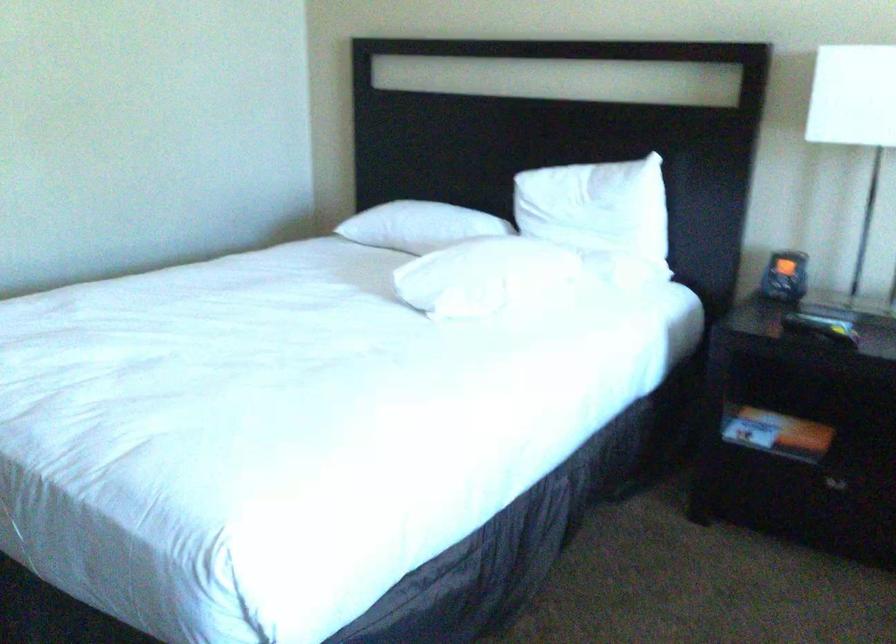
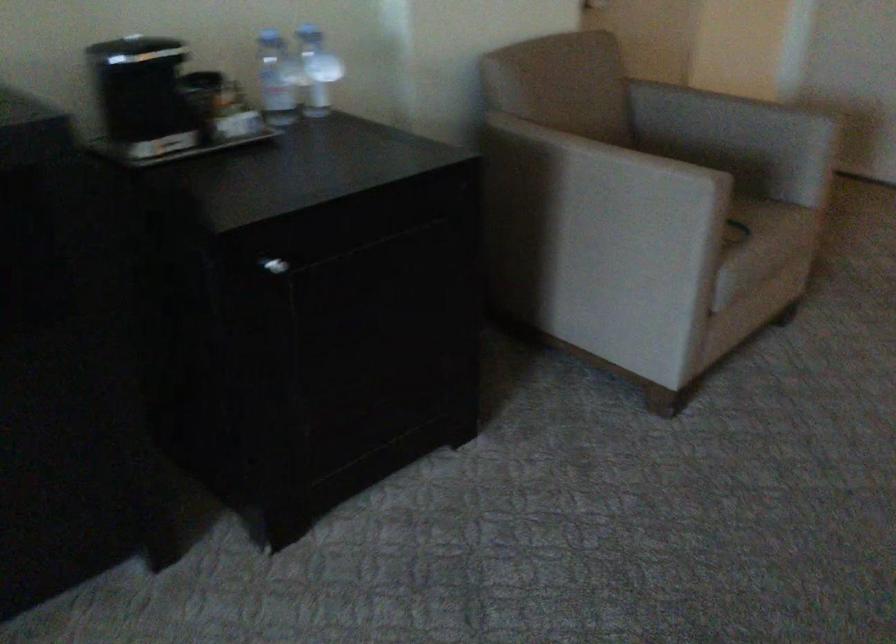
First-person continuous shooting, in which direction is the camera rotating?

The camera rotated toward left-down.